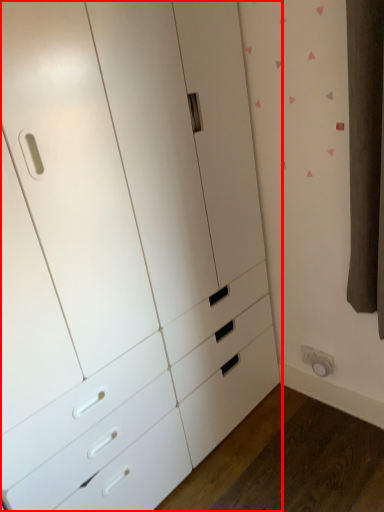
Question: From the image's perspective, where is chest of drawers (annotated by the red box) located relative to electric outlet?

Choices:
 (A) above
 (B) below

Answer: (A)